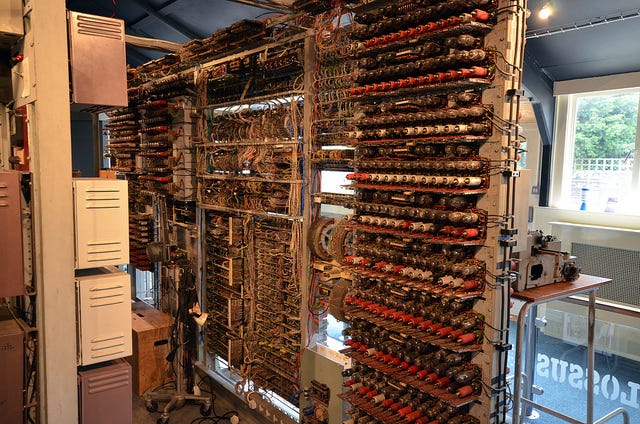
Where is `stand`? The width and height of the screenshot is (640, 424). stand is located at coordinates (173, 402).